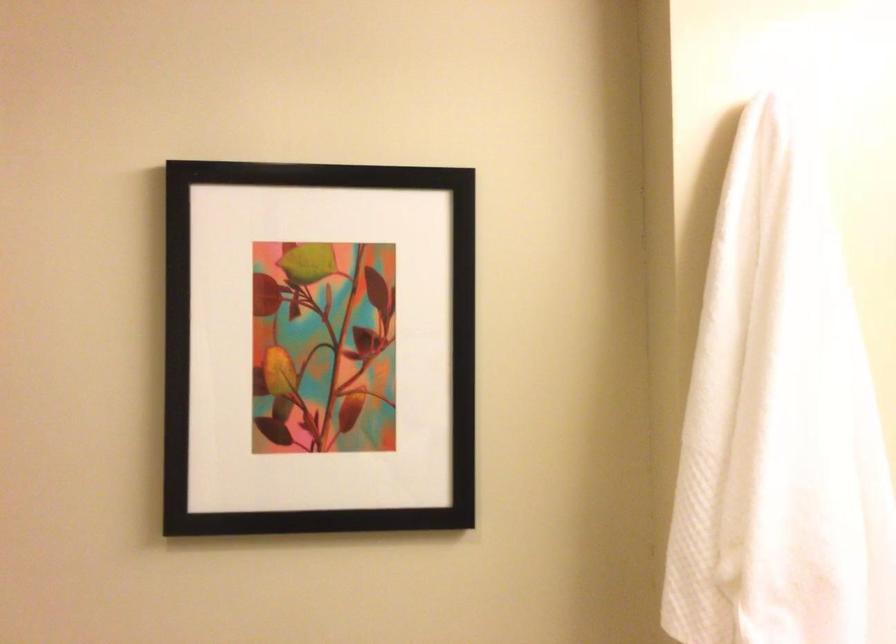
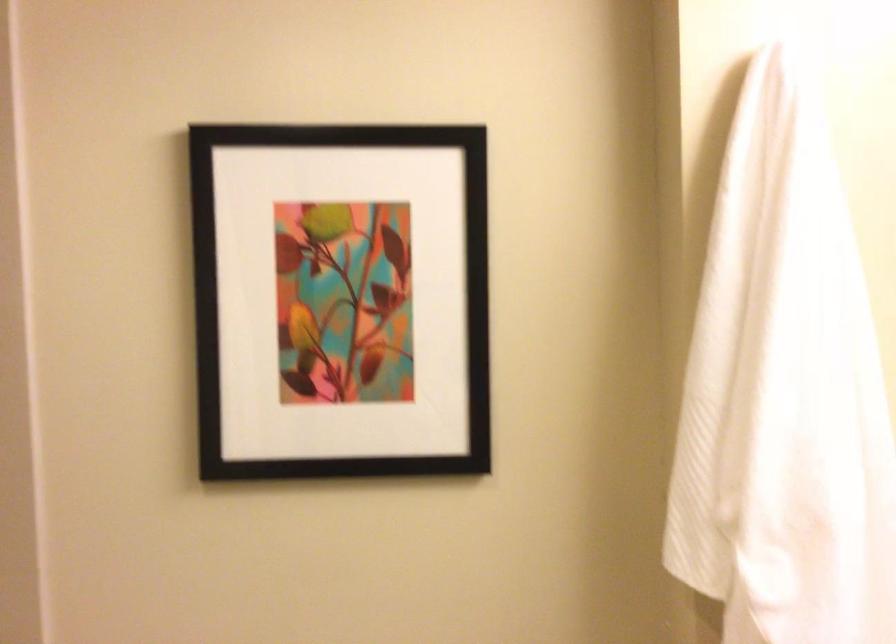
The point at (321,344) is marked in the first image. Where is the corresponding point in the second image?

(340, 299)